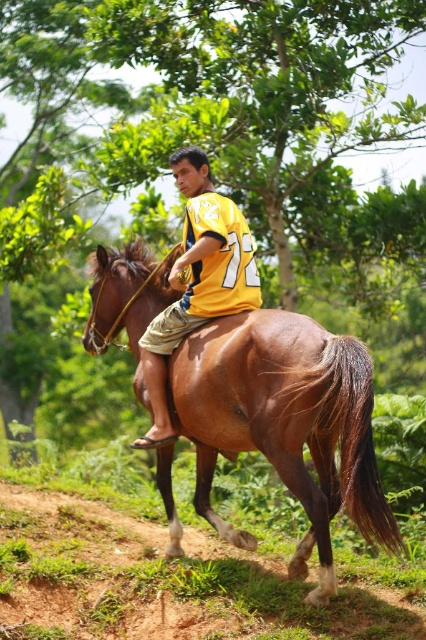
Question: Does brown glossy horse at center have a greater width compared to yellow jersey at center?

Choices:
 (A) no
 (B) yes

Answer: (B)

Question: Which of the following is the closest to the observer?

Choices:
 (A) (169, 428)
 (B) (325, 481)

Answer: (B)

Question: Does brown glossy horse at center appear over yellow jersey at center?

Choices:
 (A) yes
 (B) no

Answer: (B)

Question: Can you confirm if brown glossy horse at center is positioned to the right of yellow jersey at center?

Choices:
 (A) yes
 (B) no

Answer: (A)